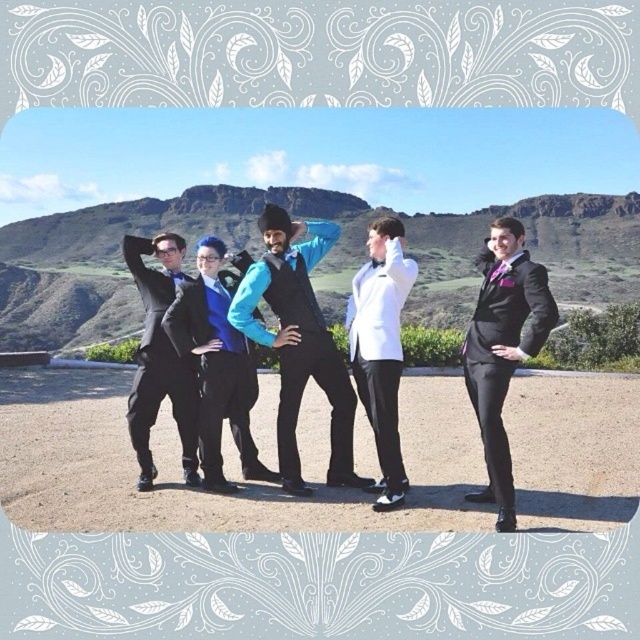
You are trying to locate the matte blue vest at center in a group of people dressed in formal attire. Given that the coordinates of the matte blue vest at center are point (298, 342), can you determine its position relative to the center of the image?

The coordinates of the matte blue vest at center are point (298, 342), which means it is positioned slightly to the right and below the exact center of the image.

You are a photographer setting up for a group photo. You need to ensure that the shiny black suit at right and the white satin tuxedo at center are both visible in the frame. Given their sizes, which one might you need to position closer to the camera to ensure it appears larger in the photo?

The shiny black suit at right is smaller than the white satin tuxedo at center. To make the smaller shiny black suit at right appear larger in the photo, you should position it closer to the camera compared to the larger white satin tuxedo at center.

Based on the photo, you are a photographer trying to adjust the camera focus. You notice the shiny black suit at right and the blue satin shirt at center. Which one is taller in the frame?

The shiny black suit at right is much taller than the blue satin shirt at center.